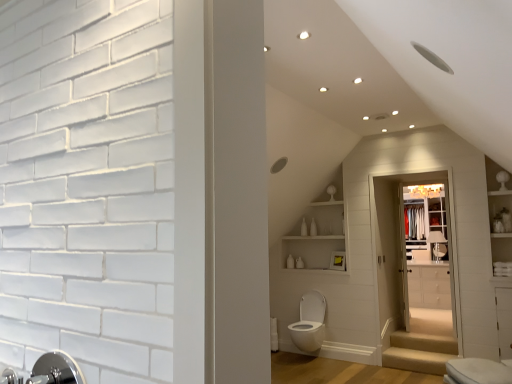
Question: Considering the relative sizes of white glossy medicine cabinet at upper center and white glossy shelves at upper center in the image provided, is white glossy medicine cabinet at upper center shorter than white glossy shelves at upper center?

Choices:
 (A) no
 (B) yes

Answer: (B)

Question: Is white glossy medicine cabinet at upper center smaller than white glossy shelves at upper center?

Choices:
 (A) yes
 (B) no

Answer: (A)

Question: Can you confirm if white glossy medicine cabinet at upper center is positioned to the right of white glossy shelves at upper center?

Choices:
 (A) yes
 (B) no

Answer: (A)

Question: Considering the relative sizes of white glossy medicine cabinet at upper center and white glossy shelves at upper center in the image provided, is white glossy medicine cabinet at upper center taller than white glossy shelves at upper center?

Choices:
 (A) no
 (B) yes

Answer: (A)

Question: Is white glossy shelves at upper center inside white glossy medicine cabinet at upper center?

Choices:
 (A) yes
 (B) no

Answer: (B)

Question: Considering the positions of white glossy cabinet at center and beige carpeted stairs at lower center, which appears as the 1th stairwell when viewed from the top, in the image, is white glossy cabinet at center wider or thinner than beige carpeted stairs at lower center, which appears as the 1th stairwell when viewed from the top,?

Choices:
 (A) wide
 (B) thin

Answer: (A)

Question: Relative to beige carpeted stairs at lower center, which is the second stairwell in bottom-to-top order, is white glossy cabinet at center in front or behind?

Choices:
 (A) behind
 (B) front

Answer: (A)

Question: Is white glossy cabinet at center spatially inside beige carpeted stairs at lower center, which is the second stairwell in bottom-to-top order, or outside of it?

Choices:
 (A) inside
 (B) outside

Answer: (B)

Question: Is point (408, 279) closer or farther from the camera than point (407, 347)?

Choices:
 (A) closer
 (B) farther

Answer: (B)

Question: Looking at their shapes, would you say white glossy medicine cabinet at upper center is wider or thinner than silver metallic faucet at lower left?

Choices:
 (A) wide
 (B) thin

Answer: (A)

Question: Is white glossy medicine cabinet at upper center in front of or behind silver metallic faucet at lower left in the image?

Choices:
 (A) behind
 (B) front

Answer: (A)

Question: Considering the positions of point (438, 198) and point (441, 236), is point (438, 198) closer or farther from the camera than point (441, 236)?

Choices:
 (A) farther
 (B) closer

Answer: (A)

Question: Is white glossy medicine cabinet at upper center taller or shorter than silver metallic faucet at lower left?

Choices:
 (A) tall
 (B) short

Answer: (A)

Question: Considering the positions of point (316, 205) and point (424, 349), is point (316, 205) closer or farther from the camera than point (424, 349)?

Choices:
 (A) closer
 (B) farther

Answer: (B)

Question: Would you say white glossy shelves at upper center is to the left or to the right of beige fabric stair at lower right, marked as the 1th stairwell in a bottom-to-top arrangement, in the picture?

Choices:
 (A) left
 (B) right

Answer: (A)